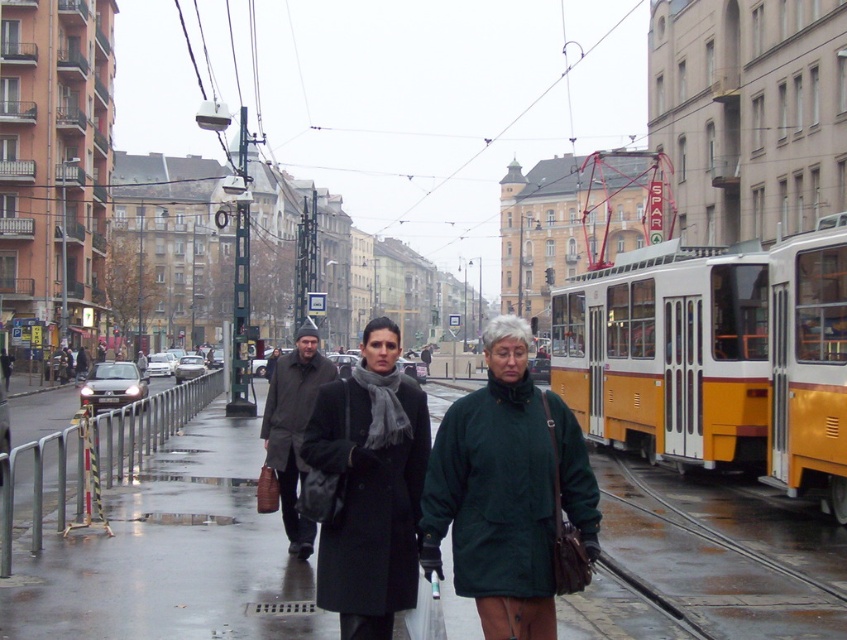
Question: Which object appears closest to the camera in this image?

Choices:
 (A) shiny asphalt pavement at center
 (B) dark brown leather coat at center

Answer: (B)

Question: Is shiny asphalt pavement at center in front of dark brown leather coat at center?

Choices:
 (A) yes
 (B) no

Answer: (B)

Question: Is shiny asphalt pavement at center bigger than green matte coat at center?

Choices:
 (A) yes
 (B) no

Answer: (A)

Question: Estimate the real-world distances between objects in this image. Which object is closer to the matte black coat at center?

Choices:
 (A) dark brown leather coat at center
 (B) green matte coat at center
 (C) shiny asphalt pavement at center

Answer: (B)

Question: Estimate the real-world distances between objects in this image. Which object is farther from the green matte coat at center?

Choices:
 (A) dark brown leather coat at center
 (B) matte black coat at center

Answer: (A)

Question: Is shiny asphalt pavement at center wider than green matte coat at center?

Choices:
 (A) yes
 (B) no

Answer: (A)